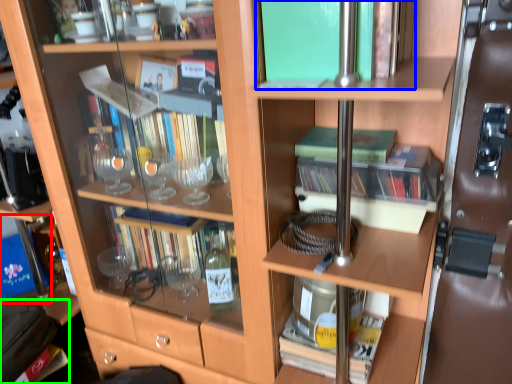
Question: Estimate the real-world distances between objects in this image. Which object is farther from box (highlighted by a red box), book (highlighted by a blue box) or handbag (highlighted by a green box)?

Choices:
 (A) book
 (B) handbag

Answer: (A)